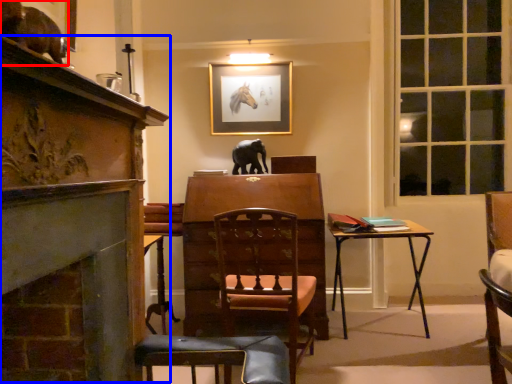
Question: Which of the following is the closest to the observer, animal (highlighted by a red box) or fireplace (highlighted by a blue box)?

Choices:
 (A) animal
 (B) fireplace

Answer: (B)